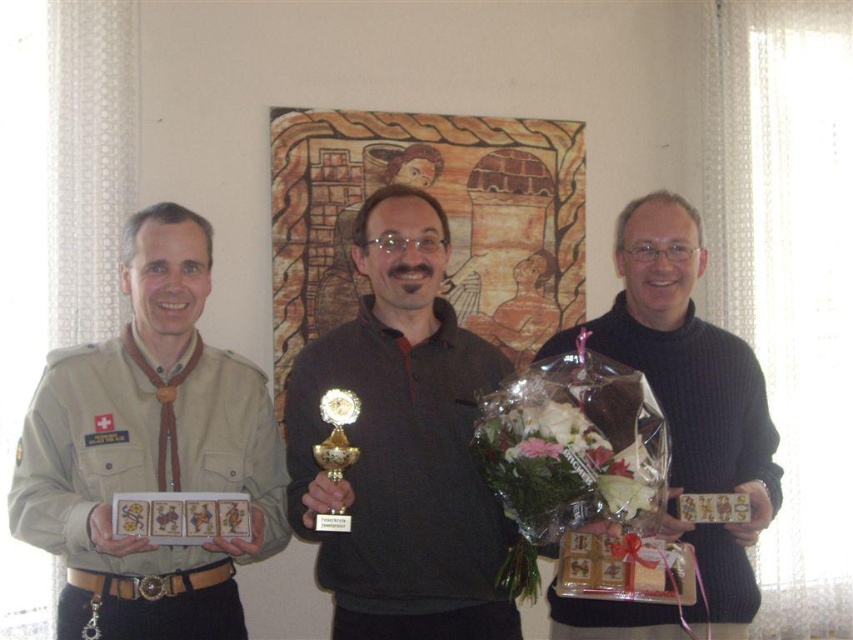
Between beige uniform at left and gold metallic medal at center, which one appears on the right side from the viewer's perspective?

beige uniform at left

Which of these two, beige uniform at left or gold metallic medal at center, stands shorter?

Standing shorter between the two is gold metallic medal at center.

Which is behind, point (202, 355) or point (84, 627)?

The point (202, 355) is more distant.

Identify the location of beige uniform at left. (149, 449).

Is fluffy bouquet at center smaller than gold metallic medal at center?

No.

Consider the image. Does fluffy bouquet at center appear on the right side of gold metallic medal at center?

Yes, fluffy bouquet at center is to the right of gold metallic medal at center.

What do you see at coordinates (572, 456) in the screenshot? The height and width of the screenshot is (640, 853). I see `fluffy bouquet at center` at bounding box center [572, 456].

The image size is (853, 640). What are the coordinates of `fluffy bouquet at center` in the screenshot? It's located at (572, 456).

Which is behind, point (67, 401) or point (701, 324)?

The point (701, 324) is more distant.

Find the location of `beige uniform at left`. beige uniform at left is located at coordinates (149, 449).